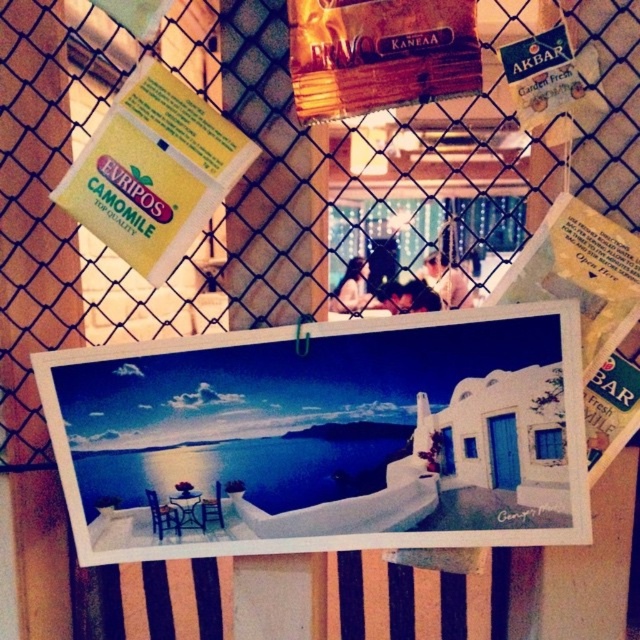
Who is more forward, (81, 520) or (177, 259)?

Point (177, 259)

Can you confirm if white matte postcard at center is shorter than yellow paper at upper left?

No, white matte postcard at center is not shorter than yellow paper at upper left.

Find the location of a particular element. white matte postcard at center is located at coordinates coord(324,436).